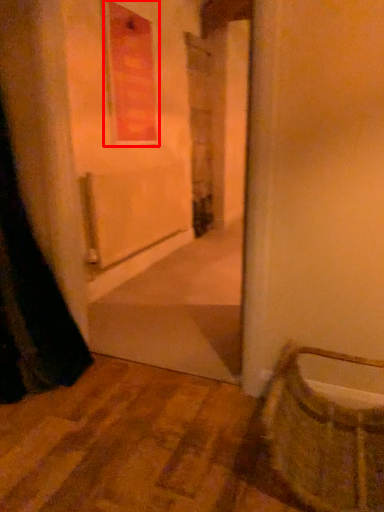
Question: Considering the relative positions of window (annotated by the red box) and basket in the image provided, where is window (annotated by the red box) located with respect to the staircase?

Choices:
 (A) right
 (B) left

Answer: (B)